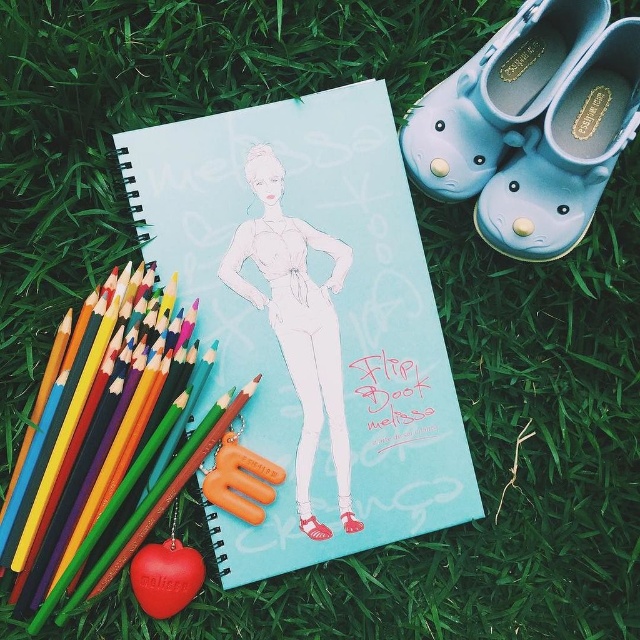
Is matte wooden pencil at lower left taller than matte blue rubber clog at upper right?

Yes, matte wooden pencil at lower left is taller than matte blue rubber clog at upper right.

This screenshot has height=640, width=640. I want to click on matte wooden pencil at lower left, so click(99, 429).

Can you confirm if matte wooden pencil at lower left is shorter than white paper at center?

Indeed, matte wooden pencil at lower left has a lesser height compared to white paper at center.

Who is lower down, matte wooden pencil at lower left or white paper at center?

matte wooden pencil at lower left is lower down.

Who is more distant from viewer, (x=189, y=330) or (x=310, y=292)?

The point (x=310, y=292) is behind.

Locate an element on the screen. matte wooden pencil at lower left is located at coordinates (99, 429).

Does light blue paper at center lie behind white paper at center?

No, it is in front of white paper at center.

I want to click on light blue paper at center, so click(x=308, y=320).